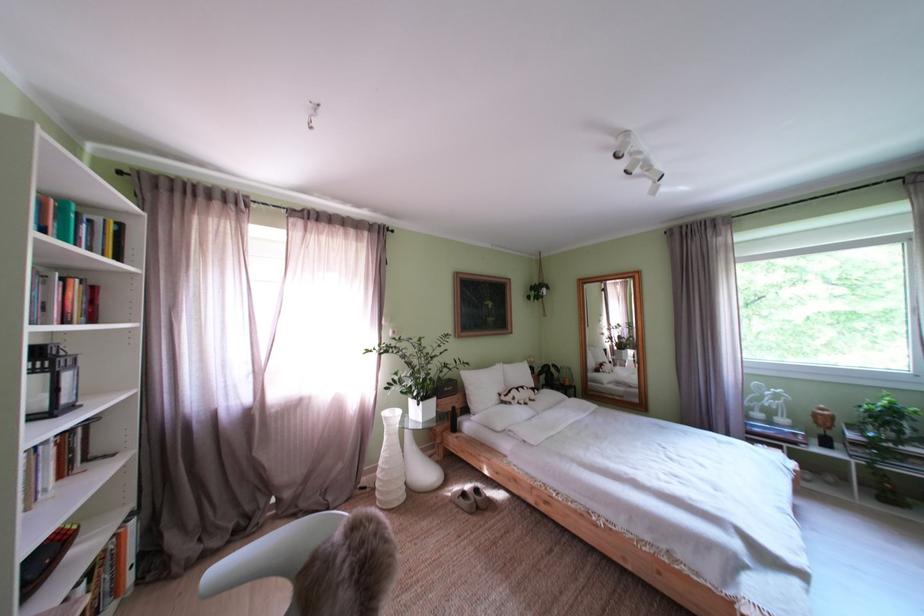
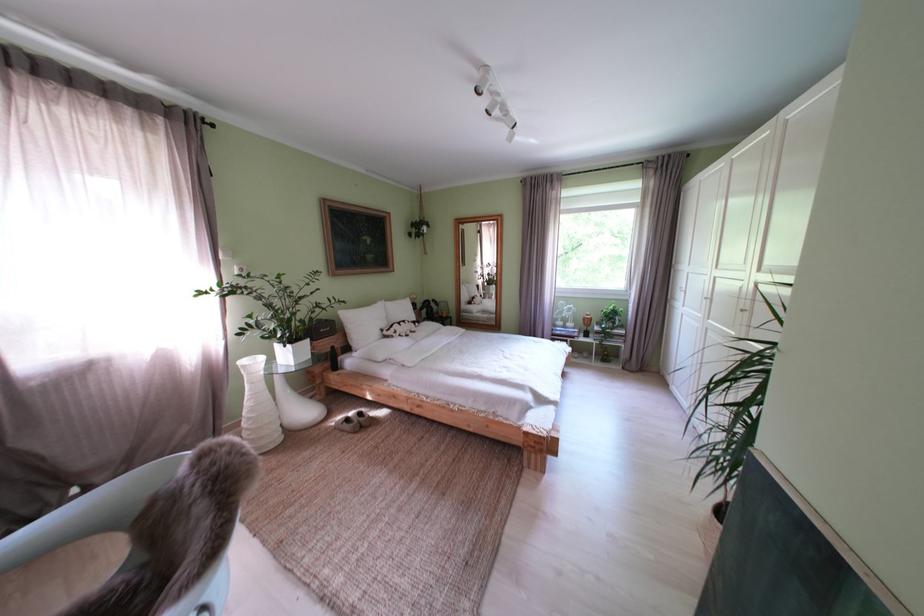
Question: How did the camera likely rotate?

Choices:
 (A) Left
 (B) Right
 (C) Up
 (D) Down

Answer: (B)